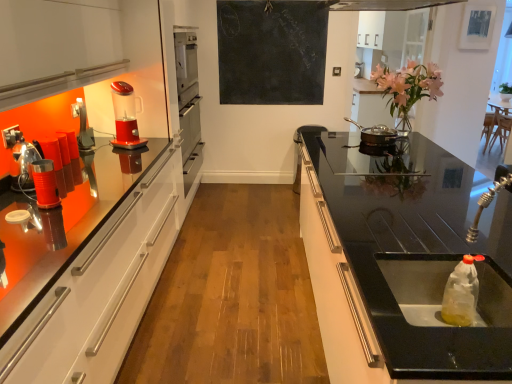
Question: Is point (31, 173) positioned closer to the camera than point (126, 100)?

Choices:
 (A) closer
 (B) farther

Answer: (A)

Question: In terms of height, does metallic stainless steel cup at left, the 2th appliance positioned from the front, look taller or shorter compared to translucent plastic blender at left?

Choices:
 (A) tall
 (B) short

Answer: (B)

Question: Which is farther from the shiny silver pan at center, the 1th appliance viewed from the back?

Choices:
 (A) translucent plastic blender at left
 (B) black chalkboard at upper center
 (C) black glass sink at right
 (D) metallic stainless steel cup at left, which is the 2th appliance in back-to-front order
 (E) metallic red canister at left, marked as the 2th appliance in a left-to-right arrangement

Answer: (D)

Question: Estimate the real-world distances between objects in this image. Which object is closer to the translucent plastic blender at left?

Choices:
 (A) shiny silver pan at center, the 1th appliance viewed from the back
 (B) black glass sink at right
 (C) metallic red canister at left, arranged as the 3th appliance when viewed from the back
 (D) metallic stainless steel cup at left, marked as the 1th appliance in a left-to-right arrangement
 (E) translucent plastic sink at lower right

Answer: (C)